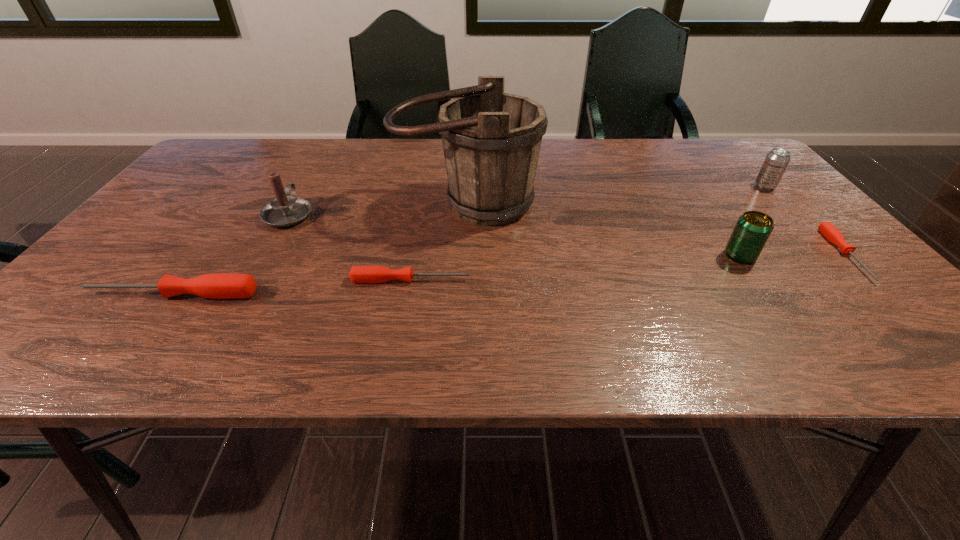
This screenshot has height=540, width=960. I want to click on free point between the second shortest screwdriver and the left beer can, so click(x=575, y=268).

The height and width of the screenshot is (540, 960). I want to click on vacant area that lies between the tallest screwdriver and the second shortest screwdriver, so click(x=291, y=287).

Identify the location of vacant region between the sixth tallest object and the bucket. The image size is (960, 540). pos(439,242).

The height and width of the screenshot is (540, 960). I want to click on vacant area between the nearest object and the farther beer can, so click(x=468, y=240).

What are the coordinates of `unoccupied position between the second tallest object and the shortest object` in the screenshot? It's located at (567, 234).

Identify the location of unoccupied area between the fifth object from left to right and the second shortest screwdriver. Image resolution: width=960 pixels, height=540 pixels. (575, 268).

Find the location of a particular element. Image resolution: width=960 pixels, height=540 pixels. vacant region between the left beer can and the shortest object is located at coordinates (793, 255).

At what (x,y) coordinates should I click in order to perform the action: click on empty location between the right beer can and the third shortest object. Please return your answer as a coordinate pair (x, y). Looking at the image, I should click on (468, 240).

This screenshot has width=960, height=540. What are the coordinates of `free point between the left beer can and the bucket` in the screenshot? It's located at (603, 230).

The width and height of the screenshot is (960, 540). What are the coordinates of `the fifth closest object to the rightmost screwdriver` in the screenshot? It's located at (285, 210).